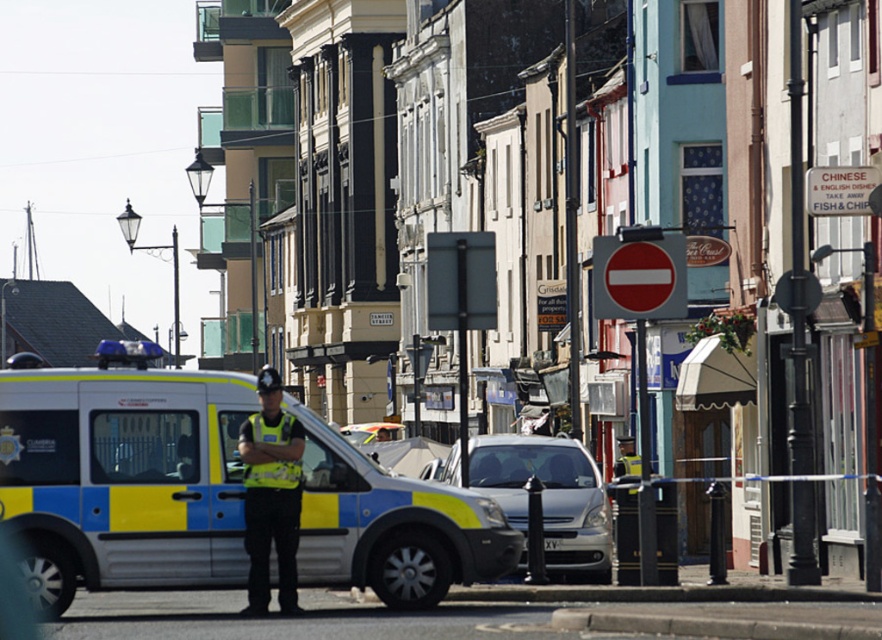
Question: Which of these objects is positioned farthest from the silver metallic sedan at center?

Choices:
 (A) neon yellow reflective vest at center
 (B) yellow and blue van at center

Answer: (A)

Question: Which point is farther from the camera taking this photo?

Choices:
 (A) (266, 413)
 (B) (481, 477)
 (C) (361, 524)
 (D) (639, 285)

Answer: (B)

Question: Among these points, which one is nearest to the camera?

Choices:
 (A) (619, 275)
 (B) (255, 513)

Answer: (B)

Question: Does silver metallic sedan at center appear on the right side of red plastic sign at center?

Choices:
 (A) no
 (B) yes

Answer: (A)

Question: From the image, what is the correct spatial relationship of yellow and blue van at center in relation to neon yellow reflective vest at center?

Choices:
 (A) right
 (B) left

Answer: (B)

Question: Can you confirm if silver metallic sedan at center is wider than red plastic sign at center?

Choices:
 (A) yes
 (B) no

Answer: (A)